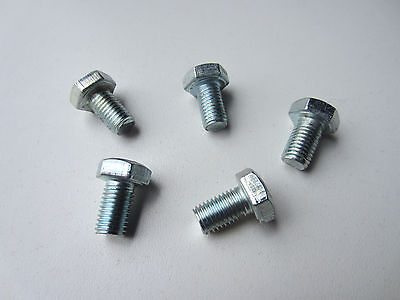
This screenshot has height=300, width=400. What are the coordinates of `table` in the screenshot? It's located at (x=342, y=231).